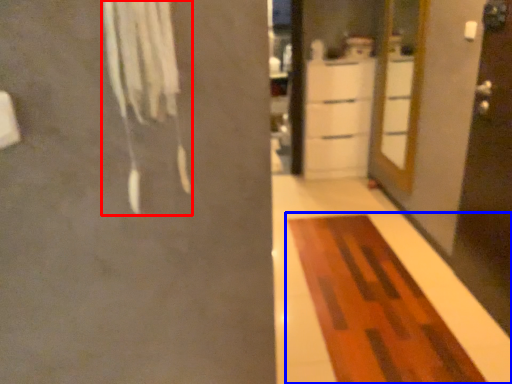
Question: Which object is further to the camera taking this photo, laundry (highlighted by a red box) or furniture (highlighted by a blue box)?

Choices:
 (A) laundry
 (B) furniture

Answer: (B)